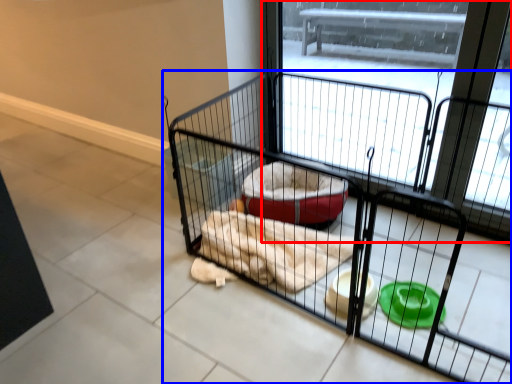
Question: Which of the following is the closest to the observer, screen door (highlighted by a red box) or cage (highlighted by a blue box)?

Choices:
 (A) screen door
 (B) cage

Answer: (B)